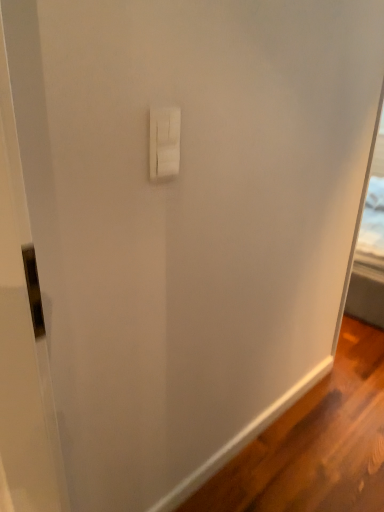
Based on the photo, measure the distance between point (x=179, y=124) and camera.

Point (x=179, y=124) and camera are 38.74 inches apart.

The height and width of the screenshot is (512, 384). Identify the location of white matte light switch at center. 164,142.

What is the approximate height of white matte light switch at center?

15.54 centimeters.

What do you see at coordinates (164, 142) in the screenshot?
I see `white matte light switch at center` at bounding box center [164, 142].

Find the location of `white matte light switch at center`. white matte light switch at center is located at coordinates (164, 142).